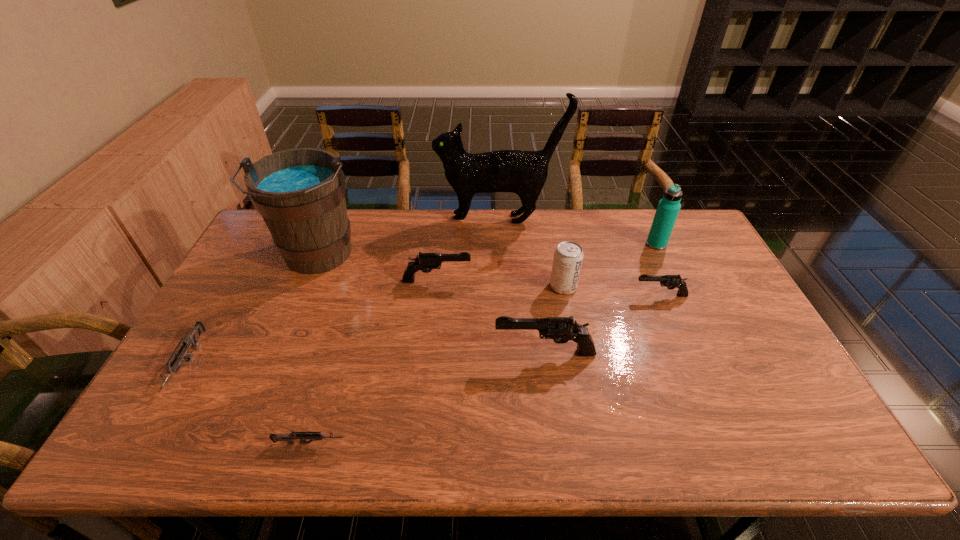
What are the coordinates of `black gun that stands as the second closest to the blue water bottle` in the screenshot? It's located at (561, 329).

Locate an element on the screen. The height and width of the screenshot is (540, 960). vacant region that satisfies the following two spatial constraints: 1. at the end of the barrel of the farthest gun; 2. on the left side of the soda can is located at coordinates (436, 286).

I want to click on blank area in the image that satisfies the following two spatial constraints: 1. on the face of the blue water bottle; 2. on the left side of the farthest object, so pyautogui.click(x=500, y=244).